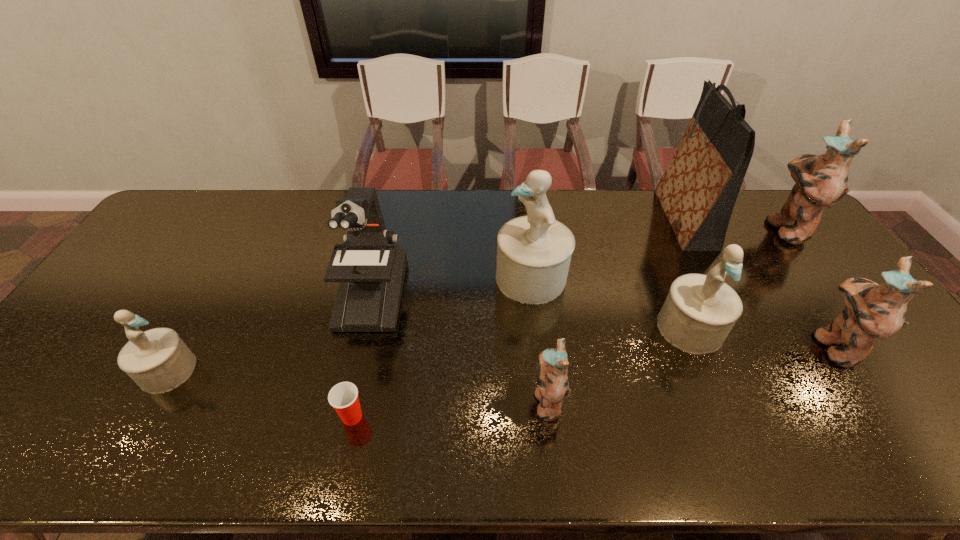
Identify the location of free space located on the front-facing side of the biggest pink figurine. This screenshot has width=960, height=540. (675, 228).

The height and width of the screenshot is (540, 960). I want to click on vacant space located 0.300m on the front-facing side of the biggest pink figurine, so click(679, 228).

This screenshot has width=960, height=540. I want to click on free space located on the front-facing side of the biggest pink figurine, so click(726, 228).

Where is `free space located through the eyepieces of the microscope`? free space located through the eyepieces of the microscope is located at coordinates (358, 348).

Where is `free space located at the beak of the third figurine from right to left`? free space located at the beak of the third figurine from right to left is located at coordinates (712, 382).

In order to click on vacant space located 0.200m on the front-facing side of the second nearest pink figurine in this screenshot , I will do pyautogui.click(x=739, y=346).

Locate an element on the screen. The image size is (960, 540). vacant space positioned on the front-facing side of the second nearest pink figurine is located at coordinates click(x=728, y=346).

Where is `vacant space located on the front-facing side of the second nearest pink figurine`? This screenshot has height=540, width=960. vacant space located on the front-facing side of the second nearest pink figurine is located at coordinates (732, 346).

At what (x,y) coordinates should I click in order to perform the action: click on free space located at the beak of the leftmost figurine. Please return your answer as a coordinate pair (x, y). The image size is (960, 540). Looking at the image, I should click on coord(214,370).

Find the location of a particular element. This screenshot has height=540, width=960. vacant space located on the front-facing side of the leftmost pink figurine is located at coordinates (494, 401).